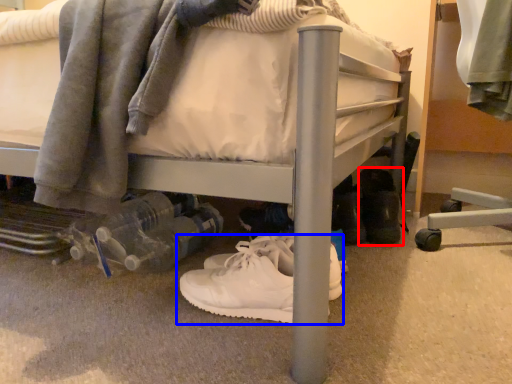
Question: Which point is further to the camera, footwear (highlighted by a red box) or footwear (highlighted by a blue box)?

Choices:
 (A) footwear
 (B) footwear

Answer: (A)